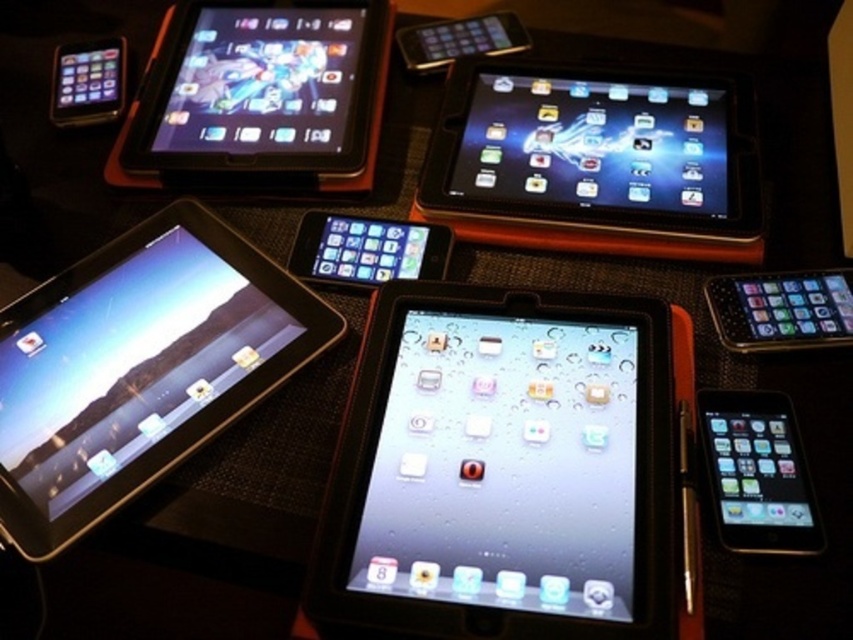
You are setting up a display for a tech showcase and need to place the satin black tablet at upper center and the matte black tablet at center on a shelf. The shelf has a width of 8 inches. Can both tablets be placed side by side without overlapping?

The satin black tablet at upper center is 8.25 inches away from the matte black tablet at center, which means the total space required between them is 8.25 inches. Since the shelf is only 8 inches wide, the tablets cannot be placed side by side without overlapping.

You are a delivery person who needs to pack these two tablets into a box. The box can only accommodate items that are 10 inches or less in distance between them. Can you safely place the black matte tablet at center and the black glossy tablet at upper right into the same box?

The black matte tablet at center and the black glossy tablet at upper right are 10.53 inches apart from each other. Since the required distance for the box is 10 inches or less, the 10.53 inches exceeds this limit. Therefore, you cannot safely place both tablets into the same box.